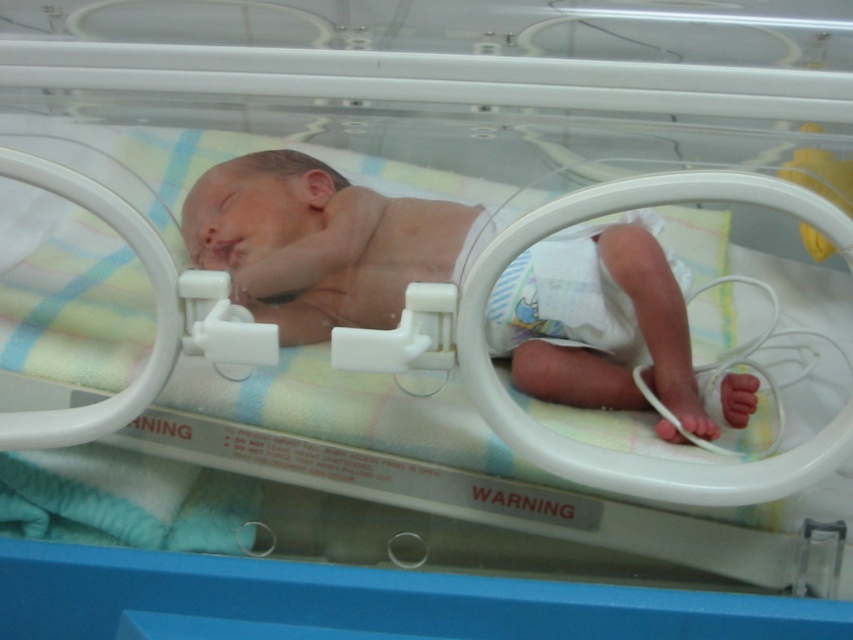
Question: Does smooth skin newborn at center appear on the right side of white cloth diaper at lower right?

Choices:
 (A) no
 (B) yes

Answer: (A)

Question: Does smooth skin newborn at center have a lesser width compared to white cloth diaper at lower right?

Choices:
 (A) yes
 (B) no

Answer: (B)

Question: Which point is closer to the camera?

Choices:
 (A) white cloth diaper at lower right
 (B) smooth skin newborn at center

Answer: (B)

Question: Among these points, which one is farthest from the camera?

Choices:
 (A) (582, 300)
 (B) (611, 346)

Answer: (B)

Question: Where is smooth skin newborn at center located in relation to white cloth diaper at lower right in the image?

Choices:
 (A) left
 (B) right

Answer: (A)